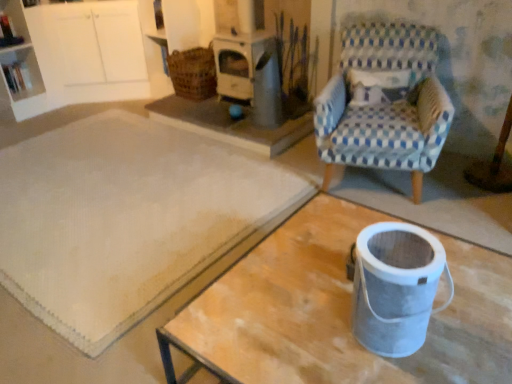
In the scene shown: What is the approximate height of white textured rug at center?

2.28 inches.

Where is `metallic gray bucket at lower right`? This screenshot has width=512, height=384. metallic gray bucket at lower right is located at coordinates (396, 287).

Identify the location of blue checkered fabric chair at upper right. (385, 103).

From the picture: Is white plastic shelf at upper left smaller than blue checkered fabric chair at upper right?

Correct, white plastic shelf at upper left occupies less space than blue checkered fabric chair at upper right.

From a real-world perspective, is white plastic shelf at upper left above or below blue checkered fabric chair at upper right?

In terms of real-world spatial position, white plastic shelf at upper left is below blue checkered fabric chair at upper right.

From the image's perspective, is white plastic shelf at upper left located above or below blue checkered fabric chair at upper right?

Clearly, from the image's perspective, white plastic shelf at upper left is above blue checkered fabric chair at upper right.

Consider the image. Is white plastic shelf at upper left taller than blue checkered fabric chair at upper right?

No, white plastic shelf at upper left is not taller than blue checkered fabric chair at upper right.

Identify the location of shelf lying above the metallic gray bucket at lower right (from the image's perspective). pos(21,72).

Is point (451, 297) closer to camera compared to point (34, 63)?

Yes, point (451, 297) is closer to viewer.

Visually, is metallic gray bucket at lower right positioned to the left or to the right of white plastic shelf at upper left?

In the image, metallic gray bucket at lower right appears on the right side of white plastic shelf at upper left.

From the image's perspective, between white plastic shelf at upper left and woven brown basket at upper center, which one is located above?

woven brown basket at upper center is shown above in the image.

Choose the correct answer: Is white plastic shelf at upper left inside woven brown basket at upper center or outside it?

white plastic shelf at upper left is located beyond the bounds of woven brown basket at upper center.

You are a GUI agent. You are given a task and a screenshot of the screen. Output one action in this format:
    pyautogui.click(x=<x>, y=<y>)
    Task: Click on the basket on the right of white plastic shelf at upper left
    This screenshot has height=384, width=512.
    Given the screenshot: What is the action you would take?
    pyautogui.click(x=193, y=73)

Is white plastic shelf at upper left oriented away from woven brown basket at upper center?

No, white plastic shelf at upper left is not facing the opposite direction of woven brown basket at upper center.

Is white textured rug at center not near woven brown basket at upper center?

white textured rug at center is far away from woven brown basket at upper center.

Locate an element on the screen. plain below the woven brown basket at upper center (from a real-world perspective) is located at coordinates coord(129,217).

Considering the points (57, 151) and (203, 47), which point is behind, point (57, 151) or point (203, 47)?

The point (203, 47) is more distant.

In the scene shown: Between white textured rug at center and woven brown basket at upper center, which one has smaller size?

Smaller between the two is woven brown basket at upper center.

Is metallic gray bucket at lower right to the left or to the right of white textured rug at center in the image?

Based on their positions, metallic gray bucket at lower right is located to the right of white textured rug at center.

Does metallic gray bucket at lower right lie in front of white textured rug at center?

Yes, metallic gray bucket at lower right is closer to the camera.

Considering the relative sizes of metallic gray bucket at lower right and white textured rug at center in the image provided, is metallic gray bucket at lower right wider than white textured rug at center?

In fact, metallic gray bucket at lower right might be narrower than white textured rug at center.

This screenshot has height=384, width=512. I want to click on appliance above the white textured rug at center (from a real-world perspective), so click(396, 287).

Considering the positions of objects blue checkered fabric chair at upper right and metallic gray bucket at lower right in the image provided, who is more to the right, blue checkered fabric chair at upper right or metallic gray bucket at lower right?

blue checkered fabric chair at upper right is more to the right.

Consider the image. Considering the sizes of blue checkered fabric chair at upper right and metallic gray bucket at lower right in the image, is blue checkered fabric chair at upper right taller or shorter than metallic gray bucket at lower right?

Clearly, blue checkered fabric chair at upper right is taller compared to metallic gray bucket at lower right.

Which object is more forward, blue checkered fabric chair at upper right or metallic gray bucket at lower right?

metallic gray bucket at lower right is closer to the camera.

Locate an element on the screen. chair that appears below the metallic gray bucket at lower right (from a real-world perspective) is located at coordinates click(385, 103).

Is white textured rug at center oriented towards blue checkered fabric chair at upper right?

No.

Which of these two, white textured rug at center or blue checkered fabric chair at upper right, is wider?

Wider between the two is white textured rug at center.

Which is correct: white textured rug at center is inside blue checkered fabric chair at upper right, or outside of it?

white textured rug at center is spatially situated outside blue checkered fabric chair at upper right.

You are a GUI agent. You are given a task and a screenshot of the screen. Output one action in this format:
    pyautogui.click(x=<x>, y=<y>)
    Task: Click on the shelf above the blue checkered fabric chair at upper right (from the image's perspective)
    The width and height of the screenshot is (512, 384).
    Given the screenshot: What is the action you would take?
    pyautogui.click(x=21, y=72)

The height and width of the screenshot is (384, 512). I want to click on shelf behind the metallic gray bucket at lower right, so click(21, 72).

When comparing their distances from blue checkered fabric chair at upper right, does white plastic shelf at upper left or white textured rug at center seem further?

white plastic shelf at upper left.

From the image, which object appears to be nearer to blue checkered fabric chair at upper right, white textured rug at center or metallic gray bucket at lower right?

The object closer to blue checkered fabric chair at upper right is white textured rug at center.

Looking at this image, estimate the real-world distances between objects in this image. Which object is further from metallic gray bucket at lower right, blue checkered fabric chair at upper right or woven brown basket at upper center?

woven brown basket at upper center is positioned further to the anchor metallic gray bucket at lower right.

When comparing their distances from woven brown basket at upper center, does white textured rug at center or white plastic shelf at upper left seem closer?

white textured rug at center is closer to woven brown basket at upper center.

Looking at the image, which one is located further to metallic gray bucket at lower right, woven brown basket at upper center or blue checkered fabric chair at upper right?

Based on the image, woven brown basket at upper center appears to be further to metallic gray bucket at lower right.

Which object lies nearer to the anchor point blue checkered fabric chair at upper right, woven brown basket at upper center or white textured rug at center?

white textured rug at center is closer to blue checkered fabric chair at upper right.

From the picture: Based on their spatial positions, is metallic gray bucket at lower right or blue checkered fabric chair at upper right closer to white plastic shelf at upper left?

The object closer to white plastic shelf at upper left is blue checkered fabric chair at upper right.

From the picture: Which object lies further to the anchor point white plastic shelf at upper left, metallic gray bucket at lower right or white textured rug at center?

metallic gray bucket at lower right is positioned further to the anchor white plastic shelf at upper left.

You are a GUI agent. You are given a task and a screenshot of the screen. Output one action in this format:
    pyautogui.click(x=<x>, y=<y>)
    Task: Click on the chair between white textured rug at center and woven brown basket at upper center from front to back
    The width and height of the screenshot is (512, 384).
    Given the screenshot: What is the action you would take?
    pyautogui.click(x=385, y=103)

Identify the location of basket between metallic gray bucket at lower right and white plastic shelf at upper left in the front-back direction. (193, 73).

Locate an element on the screen. appliance between white textured rug at center and blue checkered fabric chair at upper right from left to right is located at coordinates (396, 287).

I want to click on basket between white textured rug at center and white plastic shelf at upper left from front to back, so click(193, 73).